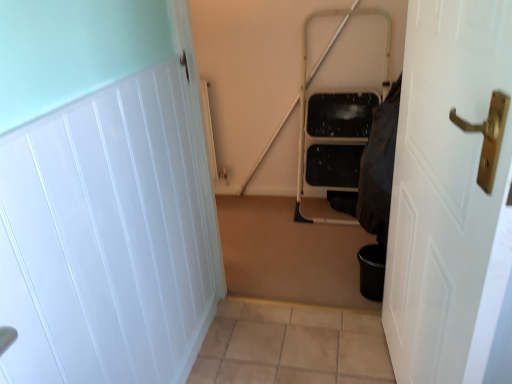
Question: Is white glossy door at right, the first door positioned from the right, shorter than black fabric at right?

Choices:
 (A) no
 (B) yes

Answer: (A)

Question: Considering the relative sizes of white glossy door at right, marked as the second door in a left-to-right arrangement, and black fabric at right in the image provided, is white glossy door at right, marked as the second door in a left-to-right arrangement, smaller than black fabric at right?

Choices:
 (A) yes
 (B) no

Answer: (B)

Question: Is white glossy door at right, marked as the second door in a left-to-right arrangement, thinner than black fabric at right?

Choices:
 (A) yes
 (B) no

Answer: (A)

Question: Does white glossy door at right, the first door positioned from the right, appear on the right side of black fabric at right?

Choices:
 (A) yes
 (B) no

Answer: (B)

Question: From a real-world perspective, is white glossy door at right, the first door positioned from the right, positioned over black fabric at right based on gravity?

Choices:
 (A) yes
 (B) no

Answer: (A)

Question: From a real-world perspective, is white glossy door at right, the first door positioned from the right, positioned under black fabric at right based on gravity?

Choices:
 (A) no
 (B) yes

Answer: (A)

Question: Are white glossy door at left, which is the second door in right-to-left order, and white glossy door at right, the first door positioned from the right, far apart?

Choices:
 (A) no
 (B) yes

Answer: (A)

Question: Considering the relative sizes of white glossy door at left, marked as the 1th door in a left-to-right arrangement, and white glossy door at right, marked as the second door in a left-to-right arrangement, in the image provided, is white glossy door at left, marked as the 1th door in a left-to-right arrangement, wider than white glossy door at right, marked as the second door in a left-to-right arrangement,?

Choices:
 (A) no
 (B) yes

Answer: (A)

Question: Is white glossy door at left, which is the second door in right-to-left order, positioned beyond the bounds of white glossy door at right, the first door positioned from the right?

Choices:
 (A) no
 (B) yes

Answer: (B)

Question: Is white glossy door at left, which is the second door in right-to-left order, to the left of white glossy door at right, the first door positioned from the right, from the viewer's perspective?

Choices:
 (A) yes
 (B) no

Answer: (A)

Question: Does white glossy door at left, which is the second door in right-to-left order, have a greater height compared to white glossy door at right, marked as the second door in a left-to-right arrangement?

Choices:
 (A) yes
 (B) no

Answer: (B)

Question: Is white glossy door at left, marked as the 1th door in a left-to-right arrangement, behind white glossy door at right, marked as the second door in a left-to-right arrangement?

Choices:
 (A) yes
 (B) no

Answer: (A)

Question: Is white glossy door at right, the first door positioned from the right, bigger than white glossy door at left, marked as the 1th door in a left-to-right arrangement?

Choices:
 (A) no
 (B) yes

Answer: (B)